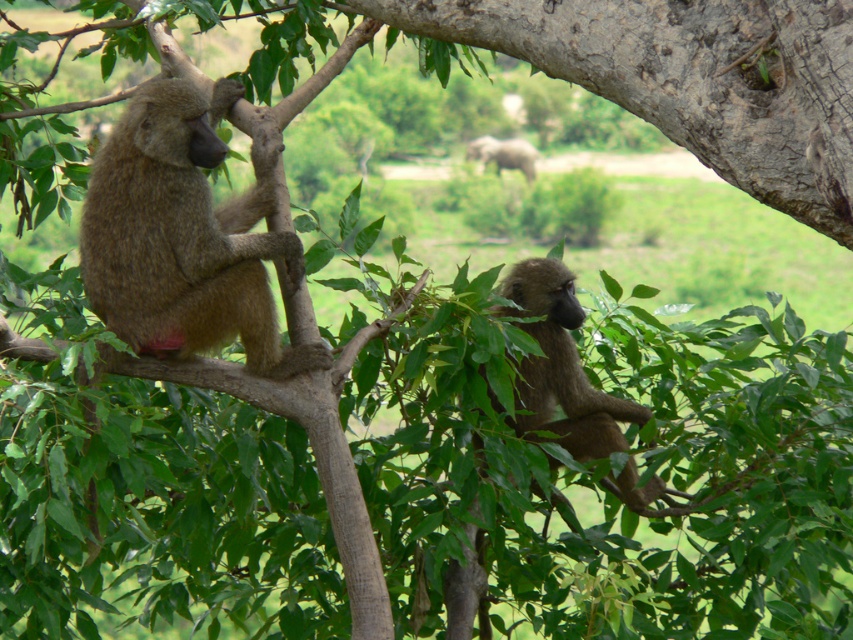
Is brown furry monkey at left smaller than brown furry monkey at center?

Incorrect, brown furry monkey at left is not smaller in size than brown furry monkey at center.

Who is taller, brown furry monkey at left or brown furry monkey at center?

With more height is brown furry monkey at left.

Is point (178, 342) farther from viewer compared to point (508, 419)?

No, (178, 342) is closer to viewer.

Identify the location of brown furry monkey at left. (183, 237).